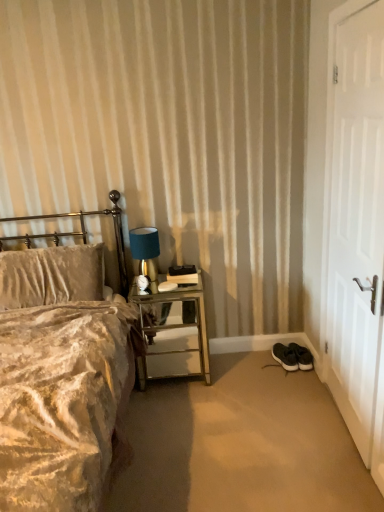
Identify the location of vacant region in front of black suede sneakers at lower right, marked as the first footwear in a left-to-right arrangement. Image resolution: width=384 pixels, height=512 pixels. (295, 375).